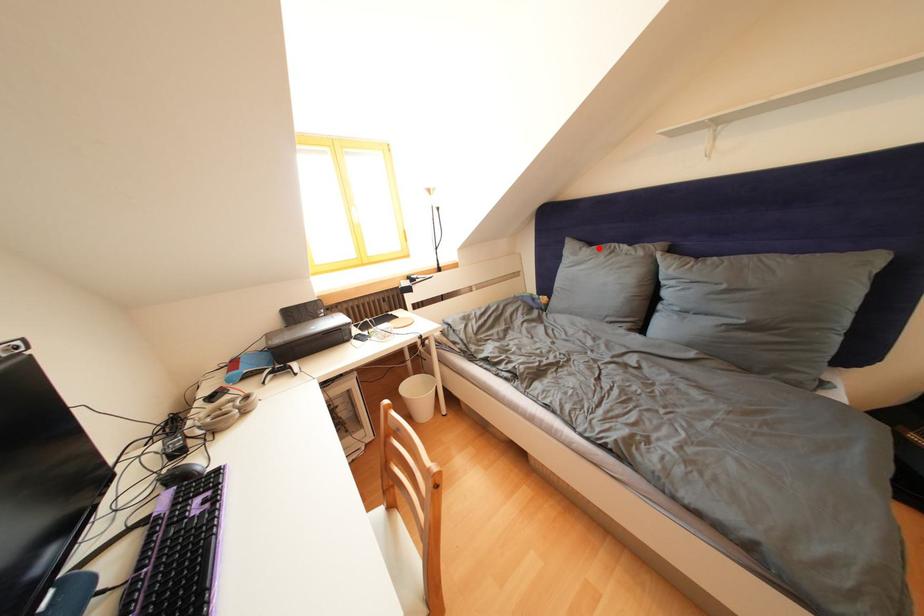
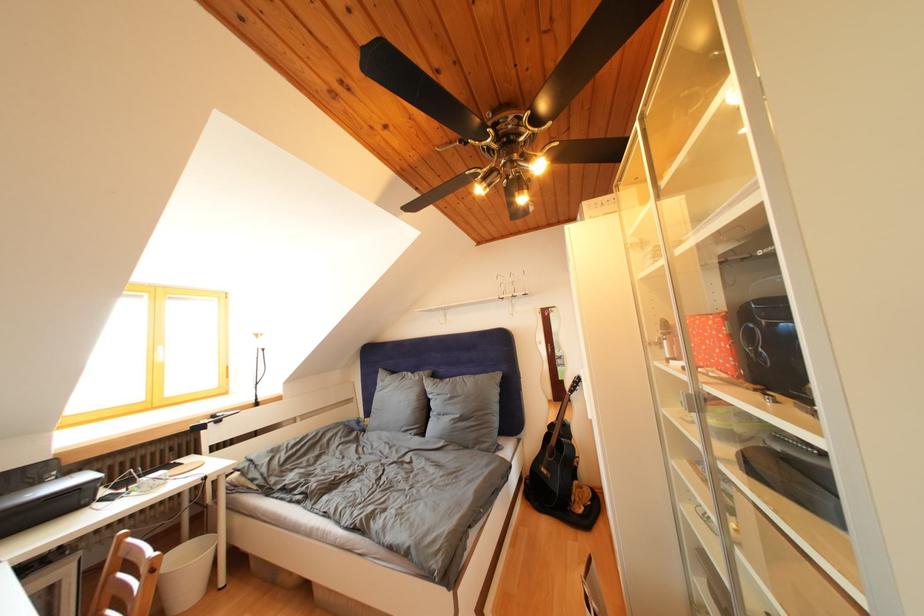
Question: I am providing you with two images of the same scene from different viewpoints. Image1 has a red point marked. In image2, the corresponding 3D location appears at what relative position? Reply with the corresponding letter.

Choices:
 (A) Closer
 (B) Farther

Answer: (B)